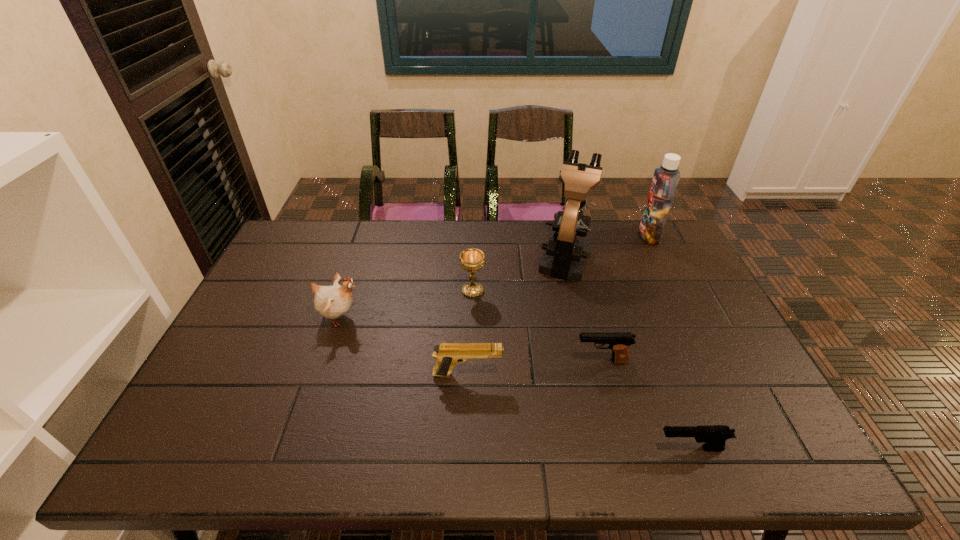
Locate an element on the screen. The height and width of the screenshot is (540, 960). free space located 0.220m on the left of the microscope is located at coordinates (470, 258).

Locate an element on the screen. The height and width of the screenshot is (540, 960). vacant space located 0.120m on the front label of the shampoo is located at coordinates (605, 235).

The width and height of the screenshot is (960, 540). Identify the location of free space located on the front label of the shampoo. (616, 235).

The image size is (960, 540). What are the coordinates of `vacant area located 0.220m on the front label of the shampoo` in the screenshot? It's located at (577, 235).

The width and height of the screenshot is (960, 540). Find the location of `free space located at the beak of the bird`. free space located at the beak of the bird is located at coordinates tap(453, 318).

Where is `blank area located 0.370m on the right of the chalice`? This screenshot has width=960, height=540. blank area located 0.370m on the right of the chalice is located at coordinates (607, 291).

Locate an element on the screen. The height and width of the screenshot is (540, 960). vacant space located 0.120m at the barrel of the leftmost pistol is located at coordinates (549, 374).

The width and height of the screenshot is (960, 540). I want to click on free space located 0.070m at the barrel of the second pistol from right to left, so click(548, 361).

I want to click on vacant space located 0.090m at the barrel of the second pistol from right to left, so click(x=540, y=361).

Identify the location of vacant space situated at the barrel of the second pistol from right to left. The image size is (960, 540). (456, 361).